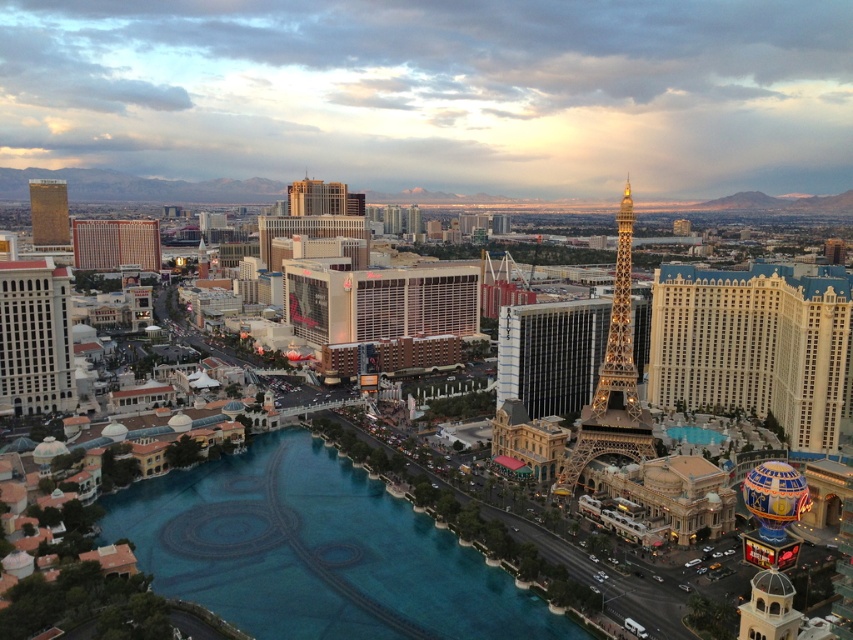
You are standing at the Eiffel Tower replica in Las Vegas and want to take a photo of both the point at coordinates (253,550) and the point at coordinates (602,420). Which point should you focus on first to ensure both are in the frame?

You should focus on point (253,550) first because it is closer to the camera than point (602,420), ensuring both points are within the frame.

You are standing at the point marked as point (845,390) in the image of Las Vegas. The Eiffel Tower replica is nearby. If you want to take a photo of the Eiffel Tower replica without any obstructions, would you need to move closer or farther away from your current position?

Since you are currently 495.19 feet away from point (845,390), which is your current position, and the Eiffel Tower replica is in the midground, you would need to move closer to the Eiffel Tower replica to ensure it is the main focus without obstructions in the foreground.

You are standing on the pathway near the lake and want to take a photo of both the gold metallic eiffel tower at center and the shiny gold metal eiffel tower at center right. Which tower should you position closer to the front of your camera frame to include both in the shot?

To include both the gold metallic eiffel tower at center and the shiny gold metal eiffel tower at center right in the shot, you should position the gold metallic eiffel tower at center closer to the front of your camera frame since it is located under the shiny gold metal eiffel tower at center right.